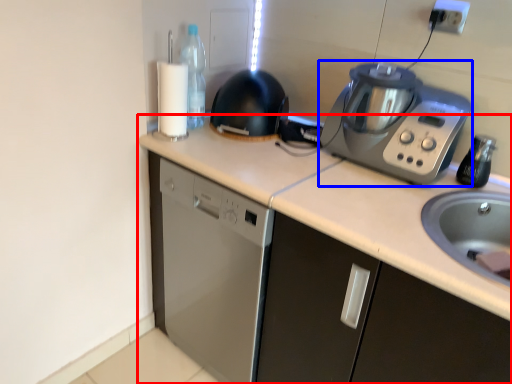
Question: Which point is further to the camera, countertop (highlighted by a red box) or home appliance (highlighted by a blue box)?

Choices:
 (A) countertop
 (B) home appliance

Answer: (B)